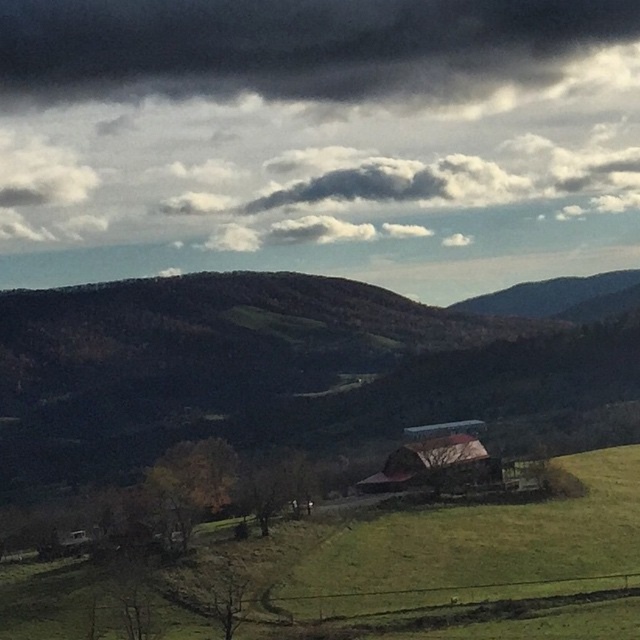
Question: Among these objects, which one is farthest from the camera?

Choices:
 (A) green grassy field at lower center
 (B) dark gray cloud at upper center

Answer: (B)

Question: Is dark gray cloud at upper center wider than green grassy field at lower center?

Choices:
 (A) yes
 (B) no

Answer: (A)

Question: Is dark gray cloud at upper center smaller than green grassy field at lower center?

Choices:
 (A) no
 (B) yes

Answer: (A)

Question: Is dark gray cloud at upper center below green grassy field at lower center?

Choices:
 (A) yes
 (B) no

Answer: (B)